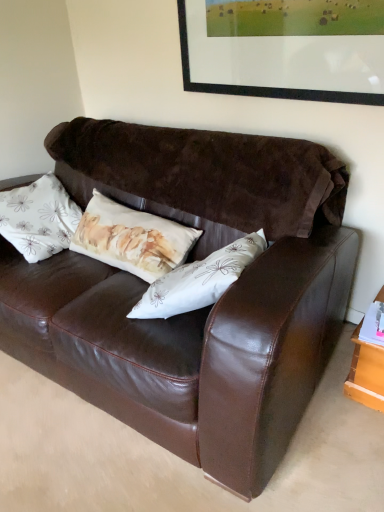
This screenshot has height=512, width=384. What are the coordinates of `brown leather couch at center` in the screenshot? It's located at (198, 310).

What do you see at coordinates (198, 310) in the screenshot? I see `brown leather couch at center` at bounding box center [198, 310].

Locate an element on the screen. The height and width of the screenshot is (512, 384). brown leather couch at center is located at coordinates (198, 310).